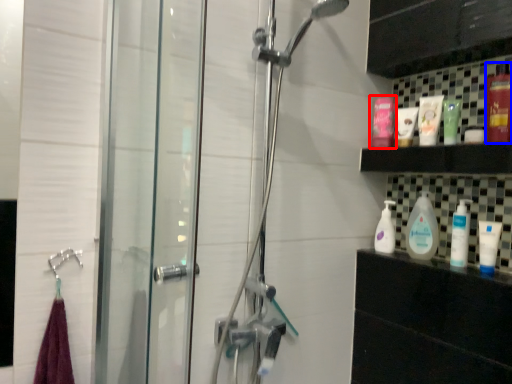
Question: Which object is closer to the camera taking this photo, mouthwash (highlighted by a red box) or mouthwash (highlighted by a blue box)?

Choices:
 (A) mouthwash
 (B) mouthwash

Answer: (B)